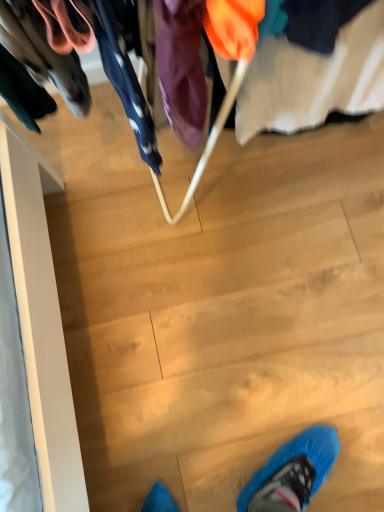
Where is `wooden hanger at upper center`? The height and width of the screenshot is (512, 384). wooden hanger at upper center is located at coordinates (297, 50).

Describe the element at coordinates (297, 50) in the screenshot. Image resolution: width=384 pixels, height=512 pixels. I see `wooden hanger at upper center` at that location.

Measure the distance between point (249, 117) and camera.

31.65 inches.

Where is `wooden hanger at upper center`? wooden hanger at upper center is located at coordinates (297, 50).